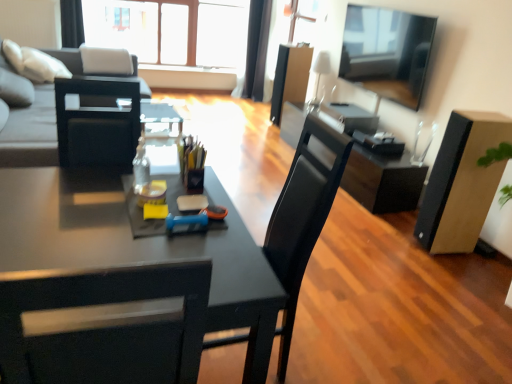
Locate an element on the screen. This screenshot has width=512, height=384. transparent glass window at upper center is located at coordinates (164, 30).

The image size is (512, 384). I want to click on matte black chair at center, so click(288, 246).

What do you see at coordinates (137, 247) in the screenshot? I see `matte black desk at center` at bounding box center [137, 247].

You are a GUI agent. You are given a task and a screenshot of the screen. Output one action in this format:
    pyautogui.click(x=<x>, y=<y>)
    Task: Click on the transparent glass window at upper center
    The image size is (512, 384).
    Given the screenshot: What is the action you would take?
    pyautogui.click(x=164, y=30)

Is point (141, 150) in front of point (300, 56)?

Yes, point (141, 150) is in front of point (300, 56).

From the image's perspective, which one is positioned lower, translucent glass bottle at center or matte black box at center, arranged as the second box when ordered from the bottom?

From the image's view, translucent glass bottle at center is below.

From a real-world perspective, is translucent glass bottle at center physically located above or below matte black box at center, the 1th box viewed from the back?

Clearly, from a real-world perspective, translucent glass bottle at center is above matte black box at center, the 1th box viewed from the back.

What's the angular difference between matte black box at center, which is counted as the first box, starting from the top, and transparent glass window at upper center's facing directions?

There is a 78.6-degree angle between the facing directions of matte black box at center, which is counted as the first box, starting from the top, and transparent glass window at upper center.

Are matte black box at center, which appears as the 1th box when viewed from the left, and transparent glass window at upper center making contact?

No.

Is matte black box at center, the 1th box viewed from the back, taller than transparent glass window at upper center?

Incorrect, the height of matte black box at center, the 1th box viewed from the back, is not larger of that of transparent glass window at upper center.

Is point (275, 109) farther from viewer compared to point (175, 34)?

That is False.

Can you confirm if white glossy lampshade at upper center is bigger than matte black desk at center?

Incorrect, white glossy lampshade at upper center is not larger than matte black desk at center.

This screenshot has width=512, height=384. Find the location of `lamp located above the matte black desk at center (from the image's perspective)`. lamp located above the matte black desk at center (from the image's perspective) is located at coordinates (319, 78).

Which point is more forward, (x=317, y=77) or (x=255, y=311)?

The point (x=255, y=311) is closer to the camera.

Is black fabric curtain at upper left, the first curtain when ordered from left to right, far from translucent glass bottle at center?

Yes.

Where is `bottle above the black fabric curtain at upper left, marked as the second curtain in a right-to-left arrangement (from a real-world perspective)`? bottle above the black fabric curtain at upper left, marked as the second curtain in a right-to-left arrangement (from a real-world perspective) is located at coordinates (141, 169).

Can you confirm if black fabric curtain at upper left, marked as the second curtain in a right-to-left arrangement, is positioned to the right of translucent glass bottle at center?

No.

Consider the image. Considering the relative sizes of black fabric curtain at upper left, which is counted as the 1th curtain, starting from the front, and translucent glass bottle at center in the image provided, is black fabric curtain at upper left, which is counted as the 1th curtain, starting from the front, smaller than translucent glass bottle at center?

No, black fabric curtain at upper left, which is counted as the 1th curtain, starting from the front, is not smaller than translucent glass bottle at center.

The height and width of the screenshot is (384, 512). Identify the location of the 2nd box above when counting from the matte black desk at center (from the image's perspective). (290, 78).

Does matte black box at center, which is counted as the first box, starting from the top, have a lesser width compared to matte black desk at center?

Yes.

Looking at this image, is matte black box at center, which ranks as the 2th box in front-to-back order, at the left side of matte black desk at center?

In fact, matte black box at center, which ranks as the 2th box in front-to-back order, is to the right of matte black desk at center.

Considering the positions of point (275, 72) and point (53, 266), is point (275, 72) closer or farther from the camera than point (53, 266)?

Clearly, point (275, 72) is more distant from the camera than point (53, 266).

From a real-world perspective, between transparent glass window at upper center and black fabric curtain at upper left, positioned as the 2th curtain in back-to-front order, who is vertically higher?

black fabric curtain at upper left, positioned as the 2th curtain in back-to-front order.

Which of these two, transparent glass window at upper center or black fabric curtain at upper left, positioned as the 2th curtain in back-to-front order, is wider?

With larger width is black fabric curtain at upper left, positioned as the 2th curtain in back-to-front order.

Is point (218, 8) positioned in front of point (72, 1)?

No, (218, 8) is behind (72, 1).

In terms of height, does transparent glass window at upper center look taller or shorter compared to black fabric curtain at upper left, the first curtain when ordered from left to right?

transparent glass window at upper center is taller than black fabric curtain at upper left, the first curtain when ordered from left to right.

Consider the image. From a real-world perspective, is matte black chair at center physically located above or below brown cardboard box at right, which is counted as the 2th box, starting from the back?

Clearly, from a real-world perspective, matte black chair at center is above brown cardboard box at right, which is counted as the 2th box, starting from the back.

Is matte black chair at center positioned with its back to brown cardboard box at right, the 2th box when ordered from top to bottom?

That's not correct — matte black chair at center is not looking away from brown cardboard box at right, the 2th box when ordered from top to bottom.

Which object is closer to the camera, matte black chair at center or brown cardboard box at right, which ranks as the 2th box in left-to-right order?

matte black chair at center is more forward.

Do you think matte black chair at center is within brown cardboard box at right, the 2th box when ordered from top to bottom, or outside of it?

matte black chair at center lies outside brown cardboard box at right, the 2th box when ordered from top to bottom.

Locate an element on the screen. The width and height of the screenshot is (512, 384). box above the translucent glass bottle at center (from the image's perspective) is located at coordinates click(290, 78).

From a real-world perspective, starting from the transparent glass window at upper center, which box is the 2nd one below it? Please provide its 2D coordinates.

[(290, 78)]

When comparing their distances from black fabric curtain at upper center, marked as the second curtain in a left-to-right arrangement, does matte black chair at center or black fabric curtain at upper left, which is counted as the 1th curtain, starting from the front, seem further?

The object further to black fabric curtain at upper center, marked as the second curtain in a left-to-right arrangement, is matte black chair at center.

In the scene shown: Which object lies further to the anchor point flat screen tv at upper right, black fabric curtain at upper center, marked as the second curtain in a left-to-right arrangement, or black fabric curtain at upper left, the first curtain when ordered from left to right?

black fabric curtain at upper left, the first curtain when ordered from left to right, is positioned further to the anchor flat screen tv at upper right.

Looking at this image, based on their spatial positions, is black glossy computer desk at center or white glossy lampshade at upper center further from translucent glass bottle at center?

The object further to translucent glass bottle at center is white glossy lampshade at upper center.

Which object lies further to the anchor point flat screen tv at upper right, black glossy computer desk at center or matte black chair at center?

matte black chair at center lies further to flat screen tv at upper right than the other object.

Looking at the image, which one is located further to matte black box at center, which is counted as the first box, starting from the top, black fabric curtain at upper center, marked as the second curtain in a left-to-right arrangement, or flat screen tv at upper right?

Based on the image, black fabric curtain at upper center, marked as the second curtain in a left-to-right arrangement, appears to be further to matte black box at center, which is counted as the first box, starting from the top.

From the image, which object appears to be farther from translucent glass bottle at center, flat screen tv at upper right or brown cardboard box at right, which appears as the 1th box when ordered from the bottom?

flat screen tv at upper right is positioned further to the anchor translucent glass bottle at center.

Estimate the real-world distances between objects in this image. Which object is closer to transparent glass window at upper center, matte black desk at center or black fabric curtain at upper left, marked as the second curtain in a right-to-left arrangement?

black fabric curtain at upper left, marked as the second curtain in a right-to-left arrangement.

Looking at the image, which one is located closer to matte black box at center, which ranks as the 2th box in front-to-back order, matte black desk at center or matte black chair at center?

Based on the image, matte black chair at center appears to be nearer to matte black box at center, which ranks as the 2th box in front-to-back order.

Where is `chair between matte black desk at center and black glossy computer desk at center along the z-axis`? The width and height of the screenshot is (512, 384). chair between matte black desk at center and black glossy computer desk at center along the z-axis is located at coordinates (288, 246).

Image resolution: width=512 pixels, height=384 pixels. In order to click on studio couch between matte black desk at center and black fabric curtain at upper center, the second curtain from the front, from front to back in this screenshot , I will do `click(31, 132)`.

Locate an element on the screen. The width and height of the screenshot is (512, 384). studio couch located between matte black desk at center and transparent glass window at upper center in the depth direction is located at coordinates (31, 132).

This screenshot has width=512, height=384. Find the location of `television between matte black chair at center and black fabric curtain at upper left, positioned as the 2th curtain in back-to-front order, along the z-axis`. television between matte black chair at center and black fabric curtain at upper left, positioned as the 2th curtain in back-to-front order, along the z-axis is located at coordinates (387, 52).